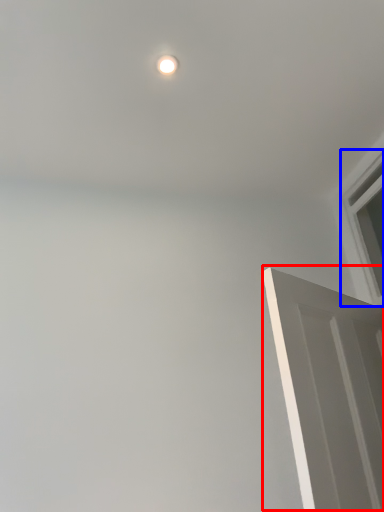
Question: Which point is further to the camera, door (highlighted by a red box) or window (highlighted by a blue box)?

Choices:
 (A) door
 (B) window

Answer: (B)